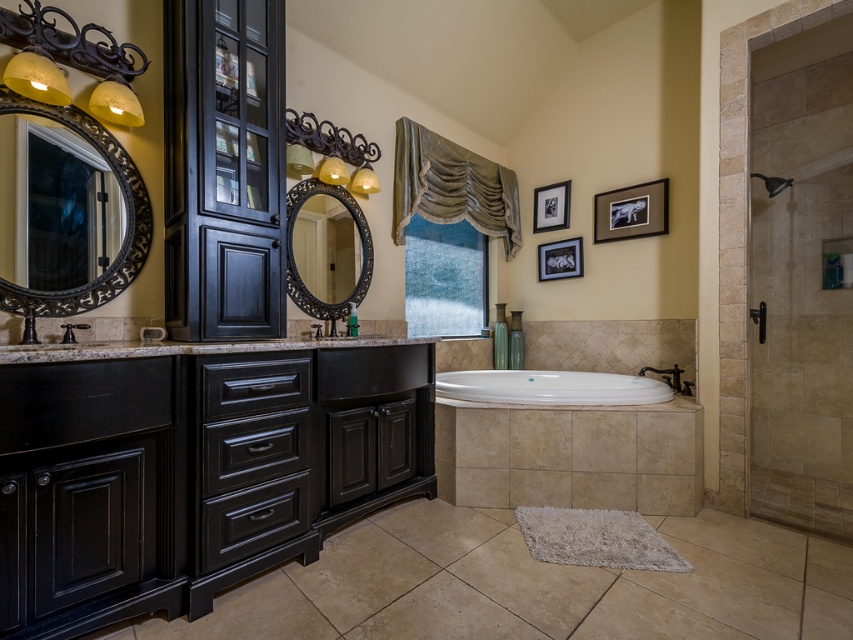
You are taking a photo of the bathroom and want to focus on both point (575, 397) and point (614, 218). Which point should you adjust your focus on first to ensure both are in sharp view?

Point (575, 397) is closer to the camera than point (614, 218), so you should focus on point (575, 397) first to ensure both points are in sharp view.

You are a plumber trying to fix a leak in the bathroom. You need to access the pipes under the white glossy bathtub at center. However, the black matte faucet at center is blocking your way. Can you move the faucet to the side to get to the pipes?

The white glossy bathtub at center is much taller than the black matte faucet at center. Since the faucet is shorter, you can move it aside to access the pipes underneath the bathtub.